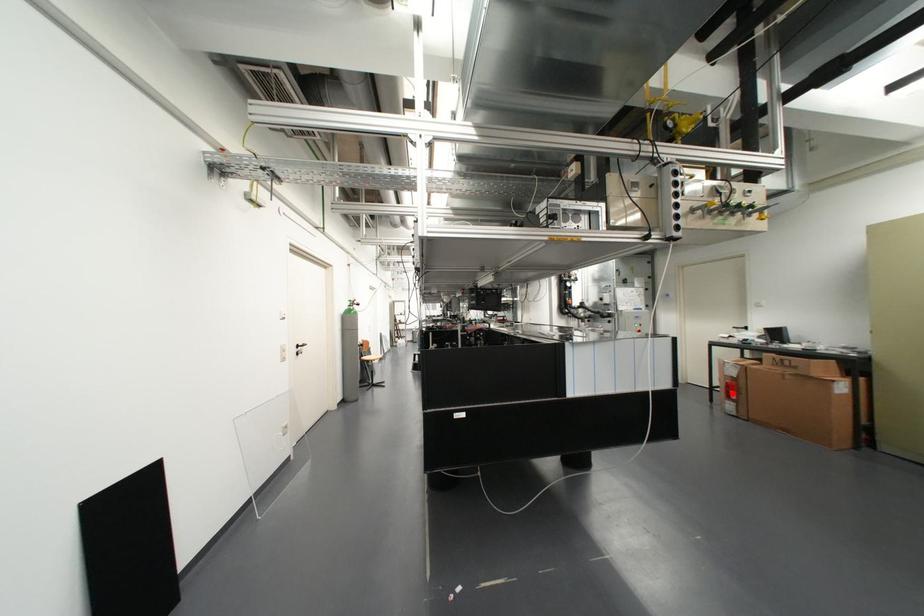
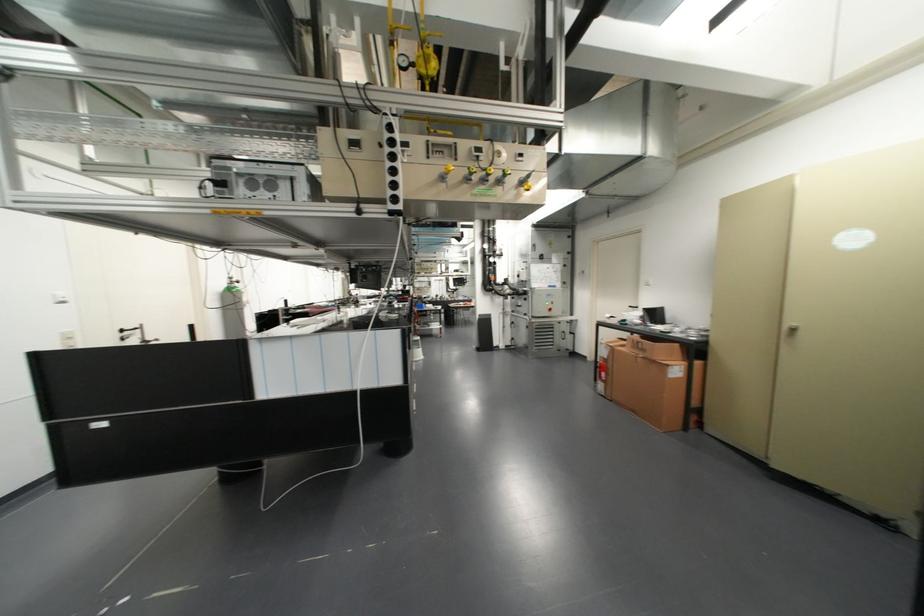
Find the pixel in the second image that matches the highlighted location in the first image.

(602, 374)